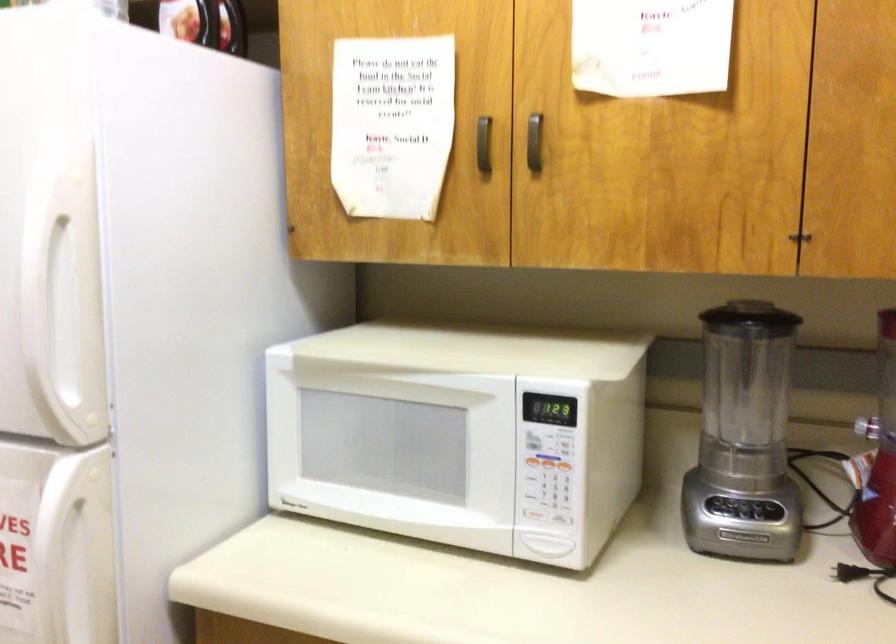
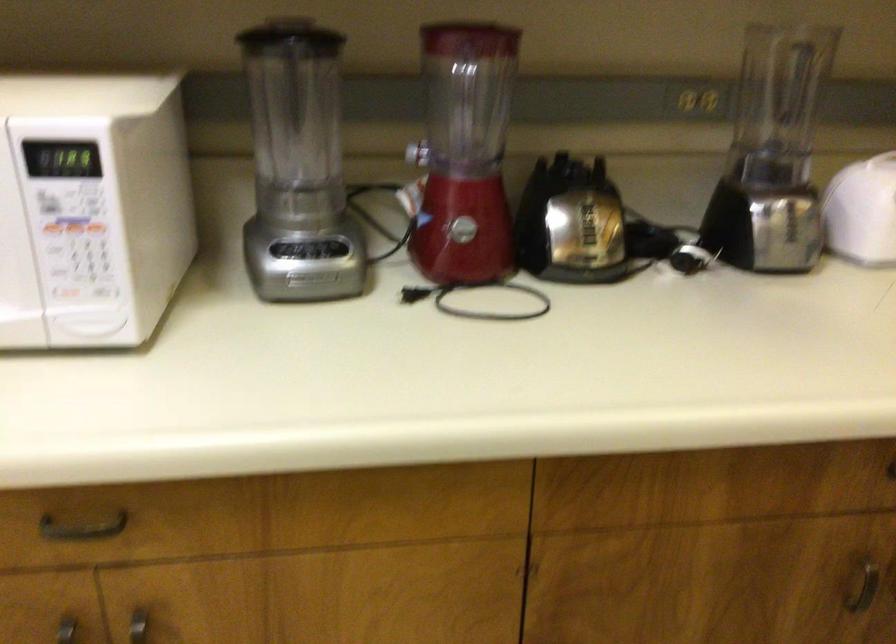
In the second image, find the point that corresponds to point (549, 477) in the first image.

(74, 242)